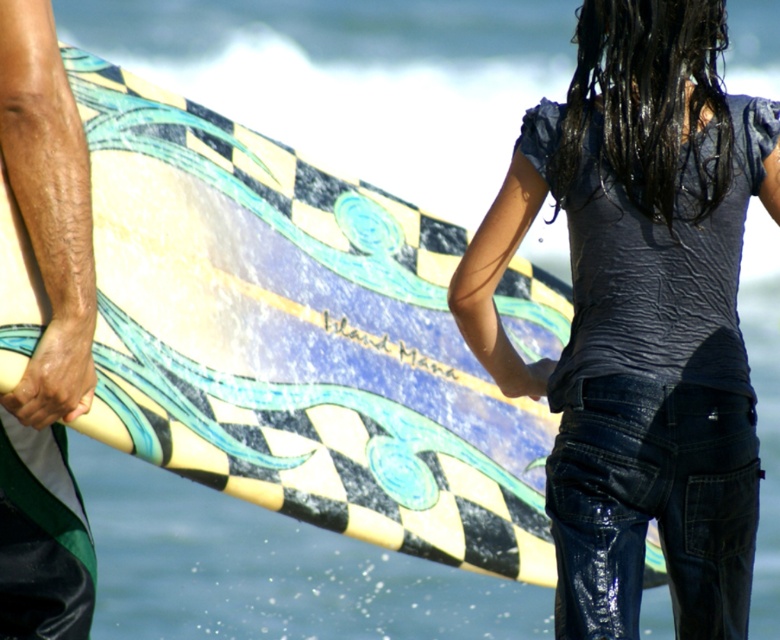
Between point (736, 144) and point (84, 371), which one is positioned behind?

The point (736, 144) is behind.

Is point (583, 65) positioned in front of point (69, 372)?

No.

Image resolution: width=780 pixels, height=640 pixels. Identify the location of denim jeans at center. (644, 314).

Locate an element on the screen. denim jeans at center is located at coordinates (644, 314).

Does matte green surfboard at left appear over smooth tan skin at lower left?

Correct, matte green surfboard at left is located above smooth tan skin at lower left.

Who is shorter, matte green surfboard at left or smooth tan skin at lower left?

smooth tan skin at lower left is shorter.

Between point (25, 227) and point (91, 317), which one is positioned in front?

Positioned in front is point (25, 227).

Locate an element on the screen. The height and width of the screenshot is (640, 780). matte green surfboard at left is located at coordinates (45, 339).

What do you see at coordinates (295, 339) in the screenshot? I see `checkered fabric surfboard at center` at bounding box center [295, 339].

Who is positioned more to the left, checkered fabric surfboard at center or smooth tan skin at lower left?

smooth tan skin at lower left

This screenshot has width=780, height=640. Describe the element at coordinates (295, 339) in the screenshot. I see `checkered fabric surfboard at center` at that location.

You are a GUI agent. You are given a task and a screenshot of the screen. Output one action in this format:
    pyautogui.click(x=<x>, y=<y>)
    Task: Click on the checkered fabric surfboard at center
    This screenshot has height=640, width=780.
    Given the screenshot: What is the action you would take?
    pyautogui.click(x=295, y=339)